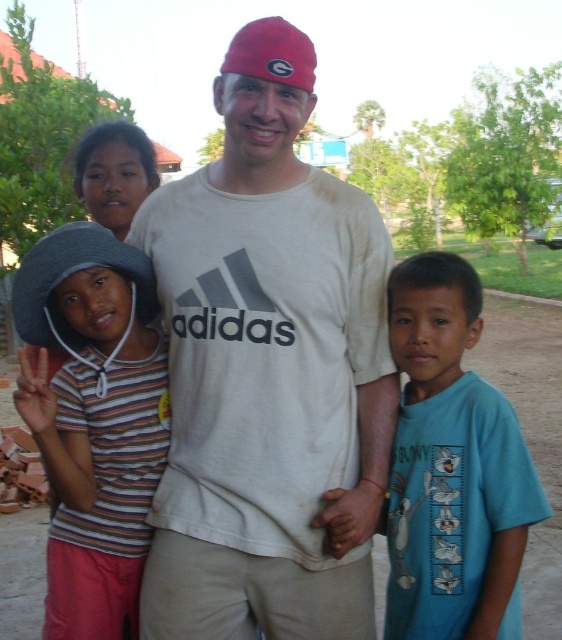
Is blue cotton shirt at right closer to the viewer compared to gray fabric baseball hat at left?

That is True.

Who is higher up, blue cotton shirt at right or gray fabric baseball hat at left?

gray fabric baseball hat at left is higher up.

Where is `blue cotton shirt at right`? blue cotton shirt at right is located at coordinates (451, 467).

You are a GUI agent. You are given a task and a screenshot of the screen. Output one action in this format:
    pyautogui.click(x=<x>, y=<y>)
    Task: Click on the blue cotton shirt at right
    The width and height of the screenshot is (562, 640).
    Given the screenshot: What is the action you would take?
    pyautogui.click(x=451, y=467)

Is white cotton t-shirt at center to the right of striped fabric hat at left from the viewer's perspective?

Correct, you'll find white cotton t-shirt at center to the right of striped fabric hat at left.

The width and height of the screenshot is (562, 640). Describe the element at coordinates (268, 371) in the screenshot. I see `white cotton t-shirt at center` at that location.

Locate an element on the screen. white cotton t-shirt at center is located at coordinates (268, 371).

Where is `white cotton t-shirt at center`? Image resolution: width=562 pixels, height=640 pixels. white cotton t-shirt at center is located at coordinates (268, 371).

Can you confirm if striped fabric hat at left is bigger than gray fabric baseball hat at left?

Indeed, striped fabric hat at left has a larger size compared to gray fabric baseball hat at left.

Between point (111, 624) and point (55, 305), which one is positioned in front?

Point (55, 305) is in front.

You are a GUI agent. You are given a task and a screenshot of the screen. Output one action in this format:
    pyautogui.click(x=<x>, y=<y>)
    Task: Click on the striped fabric hat at left
    The image size is (562, 640).
    Given the screenshot: What is the action you would take?
    pyautogui.click(x=93, y=419)